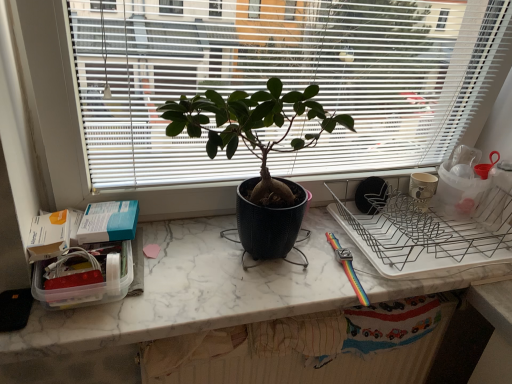
Identify the location of free point above white marble countertop at center (from a real-world perspective). This screenshot has width=512, height=384. (283, 253).